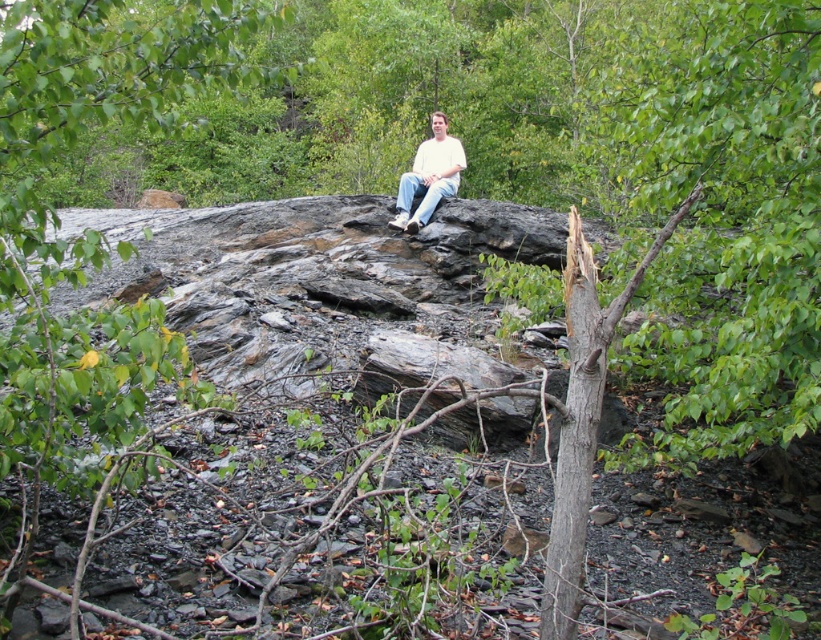
Looking at this image, does gray rough bark tree trunk at right have a larger size compared to white matte shirt at center?

Incorrect, gray rough bark tree trunk at right is not larger than white matte shirt at center.

You are a GUI agent. You are given a task and a screenshot of the screen. Output one action in this format:
    pyautogui.click(x=<x>, y=<y>)
    Task: Click on the gray rough bark tree trunk at right
    The height and width of the screenshot is (640, 821).
    Given the screenshot: What is the action you would take?
    pyautogui.click(x=576, y=436)

The height and width of the screenshot is (640, 821). What do you see at coordinates (576, 436) in the screenshot?
I see `gray rough bark tree trunk at right` at bounding box center [576, 436].

This screenshot has width=821, height=640. What are the coordinates of `gray rough bark tree trunk at right` in the screenshot? It's located at (576, 436).